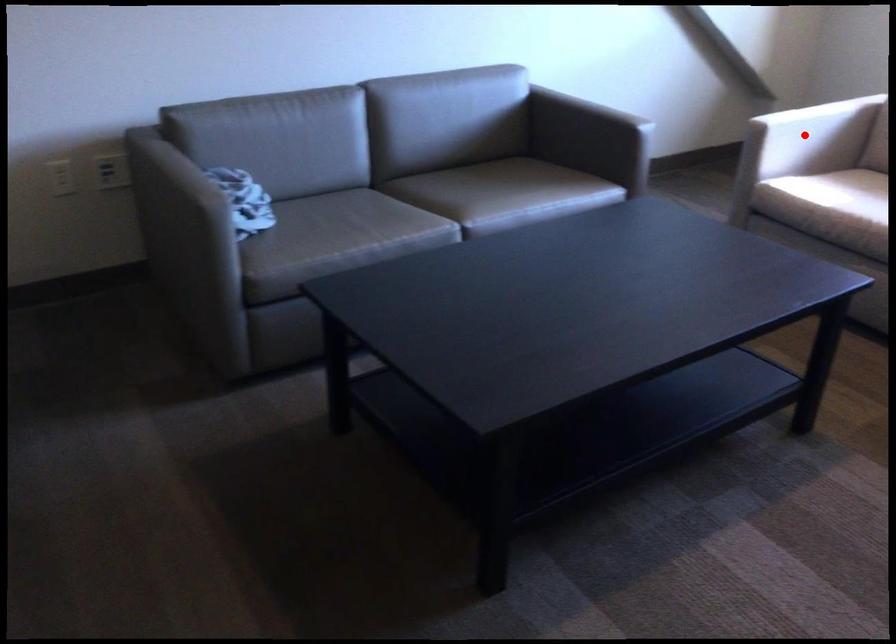
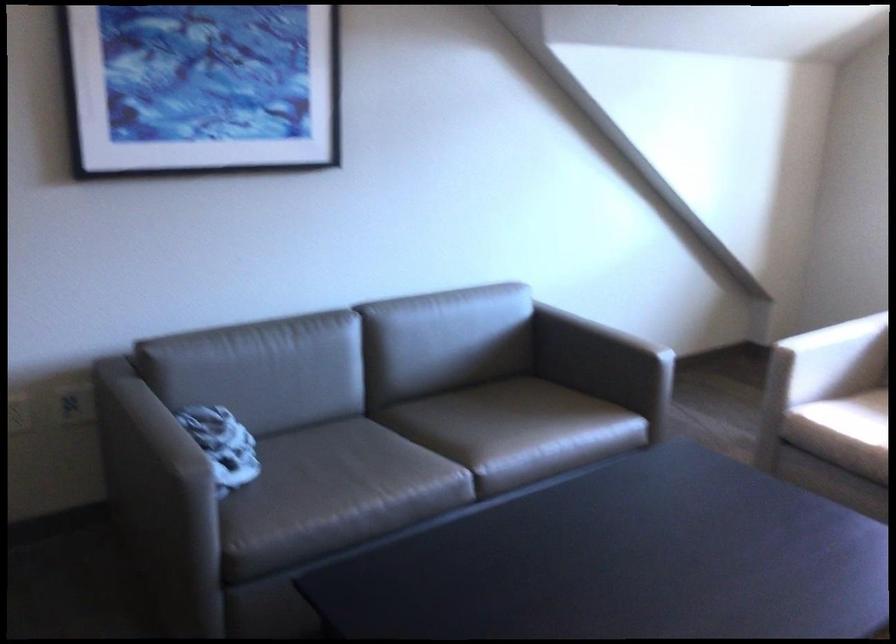
Question: I am providing you with two images of the same scene from different viewpoints. A red point is marked on the first image. Is the red point's position out of view in image 2?

Choices:
 (A) Yes
 (B) No

Answer: (B)